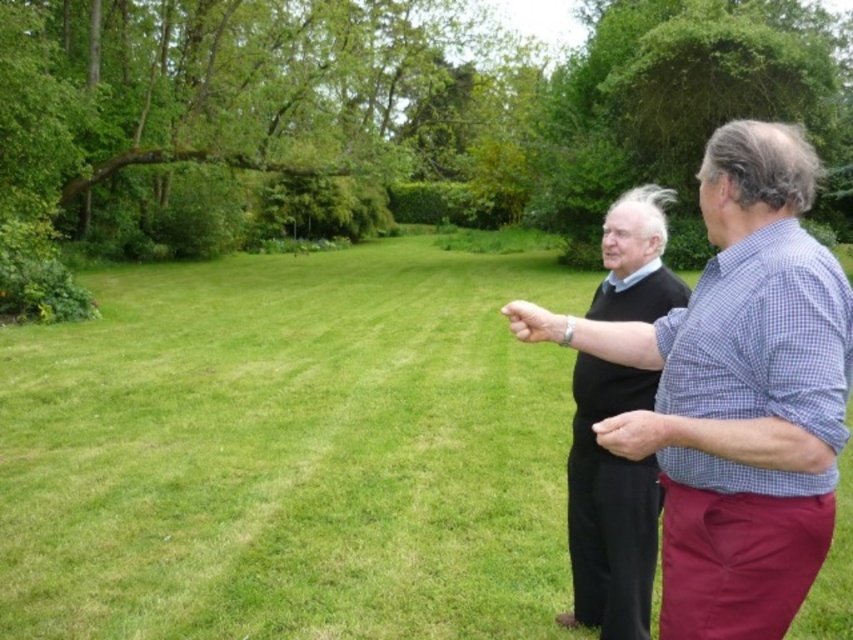
Does point (318, 561) lie in front of point (766, 616)?

That is False.

Does green grass at center have a larger size compared to checkered fabric shirt at right?

Correct, green grass at center is larger in size than checkered fabric shirt at right.

Is point (474, 564) in front of point (695, 554)?

That is False.

Locate an element on the screen. green grass at center is located at coordinates (289, 451).

Between point (801, 365) and point (646, 317), which one is positioned in front?

Point (801, 365) is in front.

Is checkered fabric shirt at right above black sweater at center?

Incorrect, checkered fabric shirt at right is not positioned above black sweater at center.

Does point (757, 294) come behind point (677, 282)?

No, it is not.

This screenshot has width=853, height=640. I want to click on checkered fabric shirt at right, so click(x=737, y=394).

Can you confirm if green grass at center is positioned below black sweater at center?

Actually, green grass at center is above black sweater at center.

Where is `green grass at center`? green grass at center is located at coordinates (289, 451).

Image resolution: width=853 pixels, height=640 pixels. What do you see at coordinates (289, 451) in the screenshot? I see `green grass at center` at bounding box center [289, 451].

The width and height of the screenshot is (853, 640). I want to click on green grass at center, so click(289, 451).